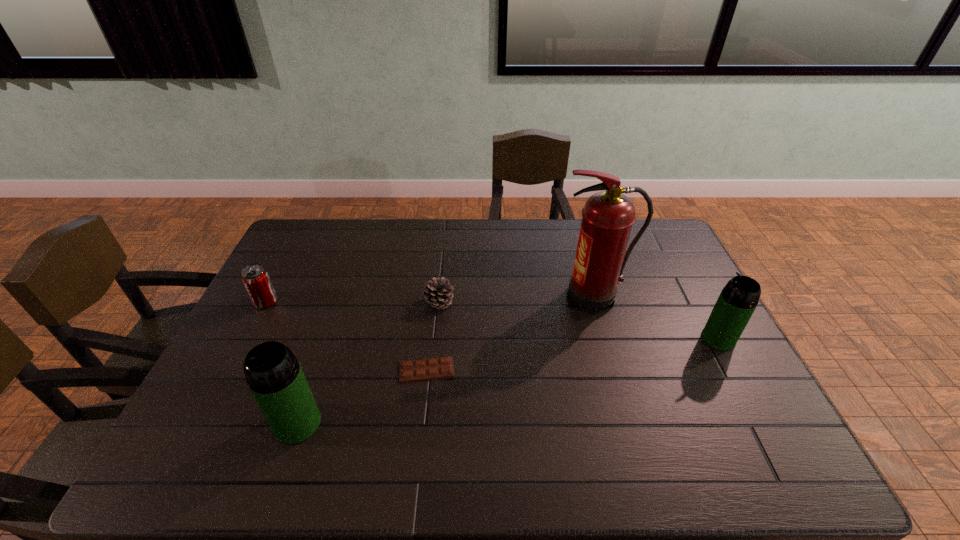
The image size is (960, 540). What are the coordinates of `free spot that satisfies the following two spatial constraints: 1. on the front-facing side of the tallest object; 2. from the spout of the nearer thermos bottle` in the screenshot? It's located at (629, 423).

You are a GUI agent. You are given a task and a screenshot of the screen. Output one action in this format:
    pyautogui.click(x=<x>, y=<y>)
    Task: Click on the free location that satisfies the following two spatial constraints: 1. on the front side of the pinecone; 2. on the right side of the pop soda
    Image resolution: width=960 pixels, height=540 pixels.
    Given the screenshot: What is the action you would take?
    pyautogui.click(x=265, y=303)